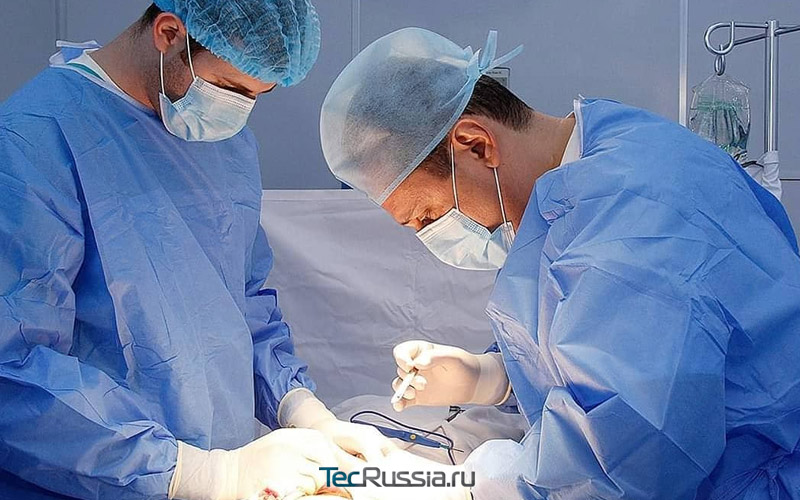
I want to click on wall, so click(x=582, y=48).